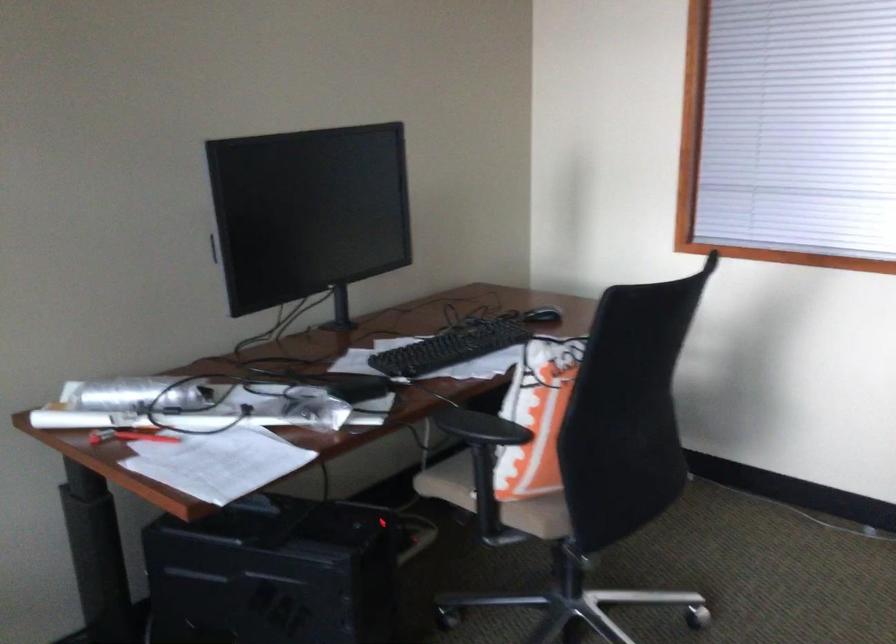
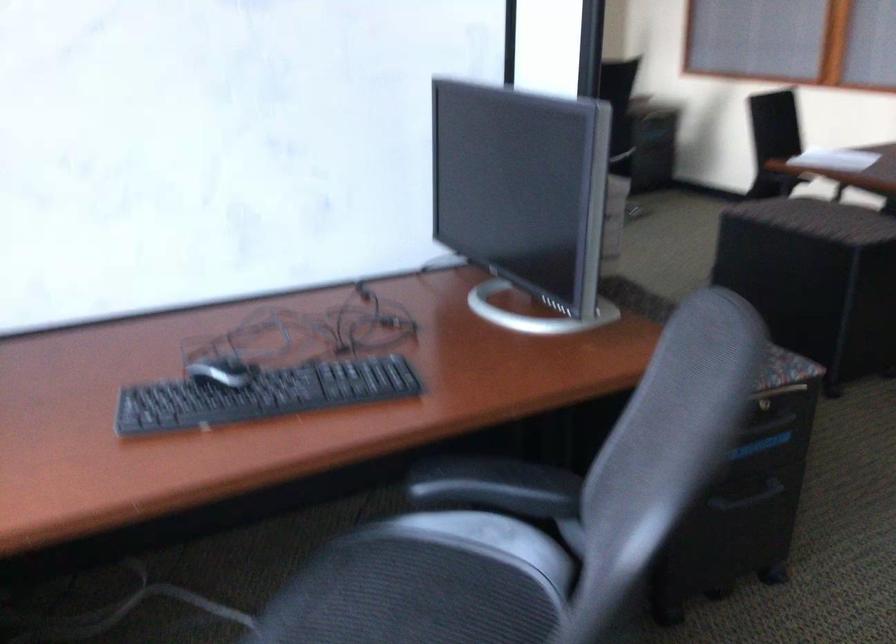
What movement of the cameraman would produce the second image?

The cameraman walked toward right, backward.